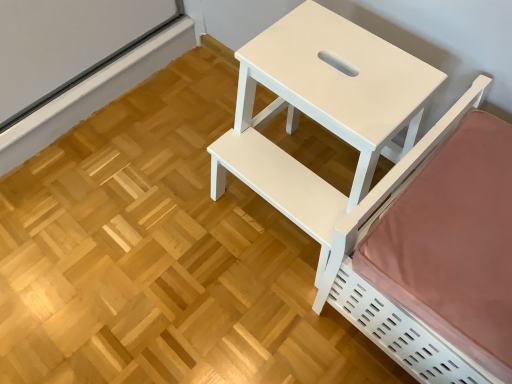
Where is `vacant space in front of white matte table at center`? This screenshot has height=384, width=512. vacant space in front of white matte table at center is located at coordinates (260, 325).